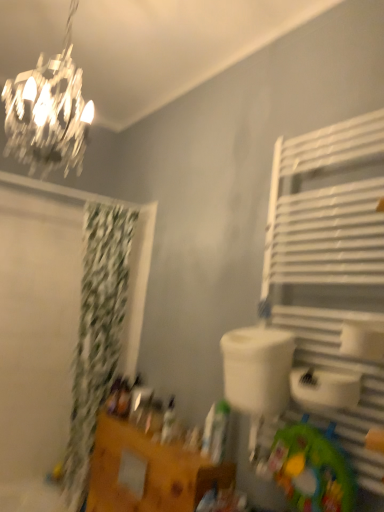
You are a GUI agent. You are given a task and a screenshot of the screen. Output one action in this format:
    pyautogui.click(x=<x>, y=<y>)
    Task: Click on the free space above green fabric mat at lower right (from a real-world perspective)
    
    Given the screenshot: What is the action you would take?
    pyautogui.click(x=312, y=418)